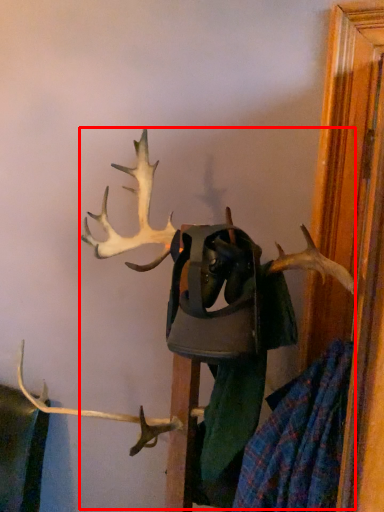
Question: From the image's perspective, where is deer (annotated by the red box) located in relation to clothing in the image?

Choices:
 (A) below
 (B) above

Answer: (B)